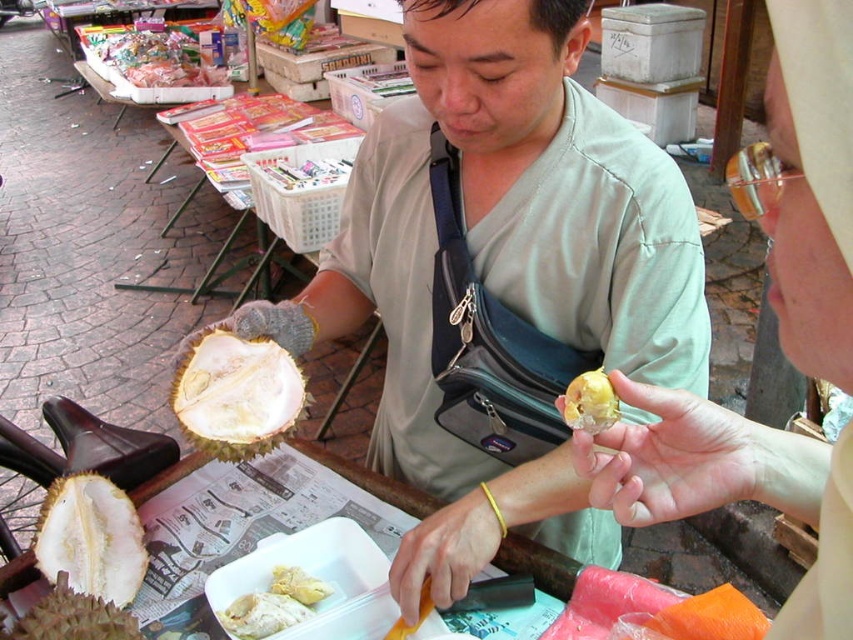
Question: Does smooth golden durian at center have a larger size compared to white textured durian at center?

Choices:
 (A) no
 (B) yes

Answer: (B)

Question: Which point is farther to the camera?

Choices:
 (A) (71, 618)
 (B) (117, 566)

Answer: (B)

Question: Which point is farther to the camera?

Choices:
 (A) (265, 630)
 (B) (119, 625)
 (C) (192, 342)

Answer: (C)

Question: Among these points, which one is nearest to the camera?

Choices:
 (A) (137, 632)
 (B) (103, 552)

Answer: (A)

Question: Does white matte durian at center have a greater width compared to yellow matte durian at center?

Choices:
 (A) yes
 (B) no

Answer: (A)

Question: Can you confirm if white textured durian at center is smaller than yellowish durian at lower left?

Choices:
 (A) yes
 (B) no

Answer: (A)